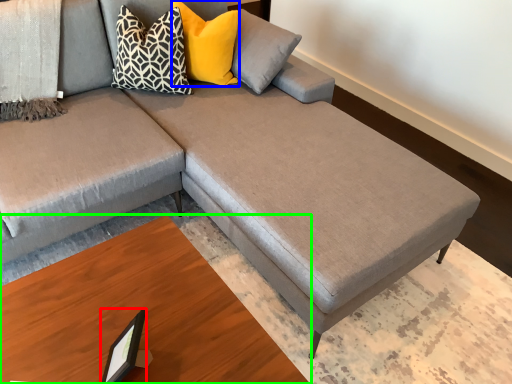
Question: Based on their relative distances, which object is nearer to picture frame (highlighted by a red box)? Choose from pillow (highlighted by a blue box) and table (highlighted by a green box).

Choices:
 (A) pillow
 (B) table

Answer: (B)